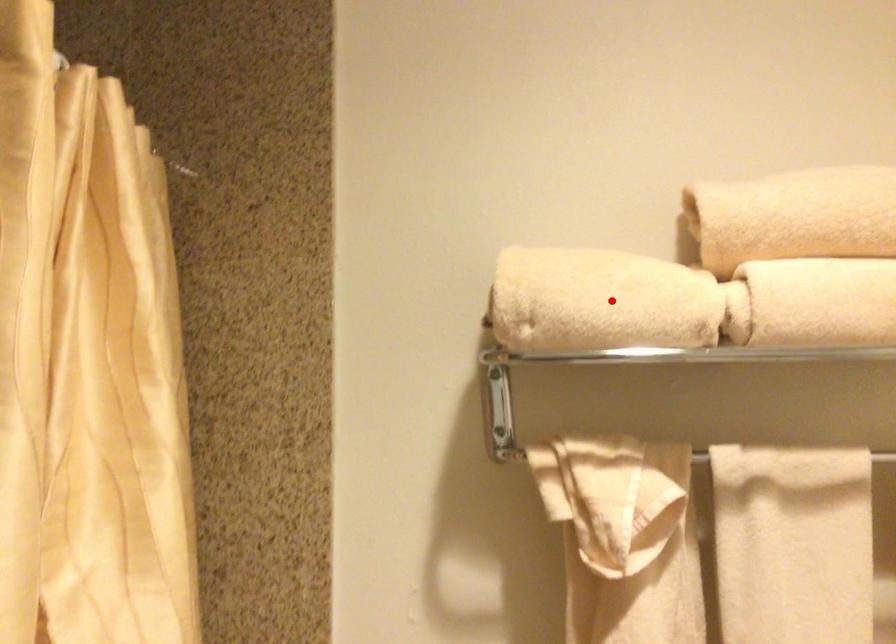
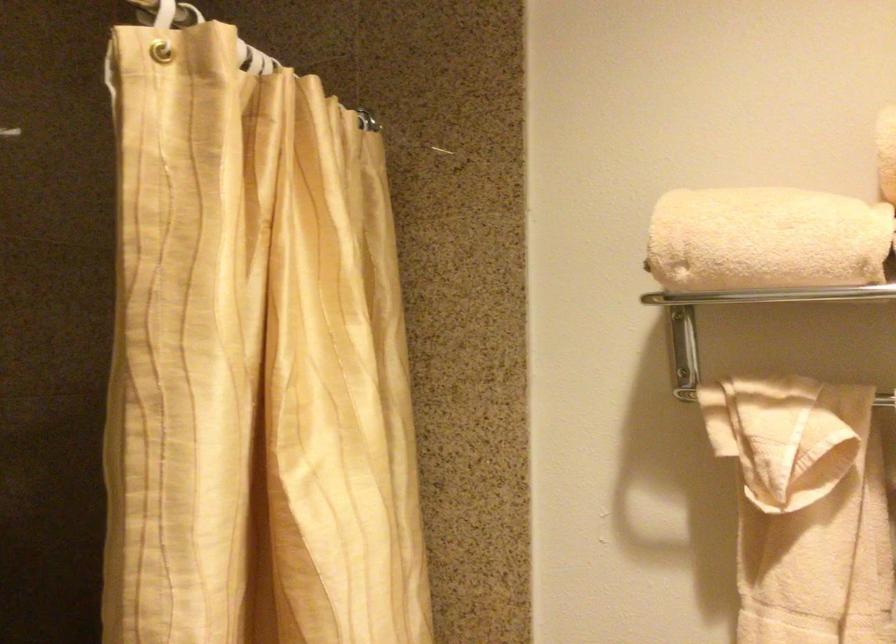
Question: I am providing you with two images of the same scene from different viewpoints. A red point is marked on the first image. At the location where the point appears in image 1, is it still visible in image 2?

Choices:
 (A) Yes
 (B) No

Answer: (A)